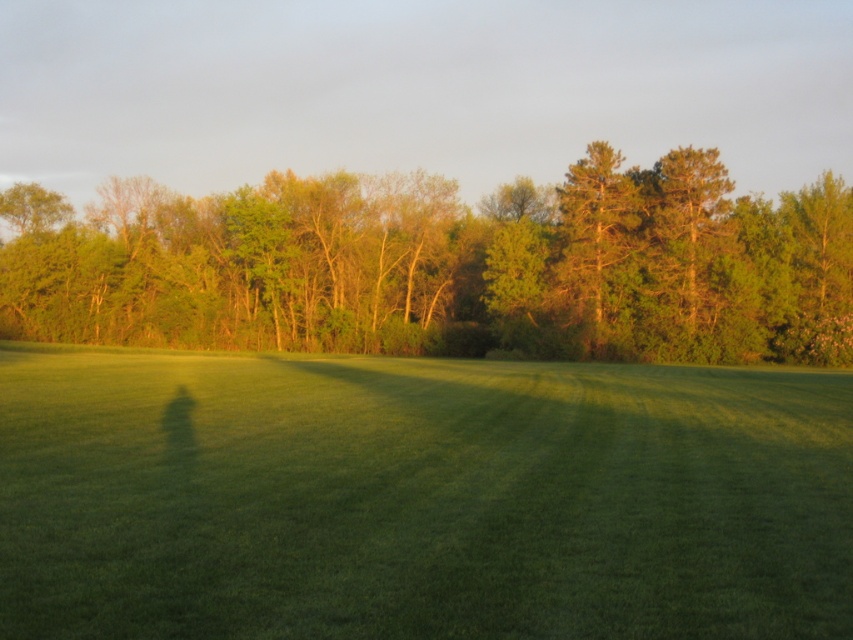
Question: Which of the following is the closest to the observer?

Choices:
 (A) (599, 314)
 (B) (86, 230)
 (C) (682, 428)

Answer: (C)

Question: In this image, where is green leafy forest at upper center located relative to green textured tree at center?

Choices:
 (A) left
 (B) right

Answer: (A)

Question: Which point is closer to the camera?

Choices:
 (A) (245, 502)
 (B) (74, 236)
 (C) (630, 179)

Answer: (A)

Question: Estimate the real-world distances between objects in this image. Which object is closer to the green leafy forest at upper center?

Choices:
 (A) green textured tree at center
 (B) green grass at center

Answer: (A)

Question: Does green grass at center have a lesser width compared to green textured tree at center?

Choices:
 (A) no
 (B) yes

Answer: (A)

Question: Does green grass at center have a smaller size compared to green textured tree at center?

Choices:
 (A) no
 (B) yes

Answer: (B)